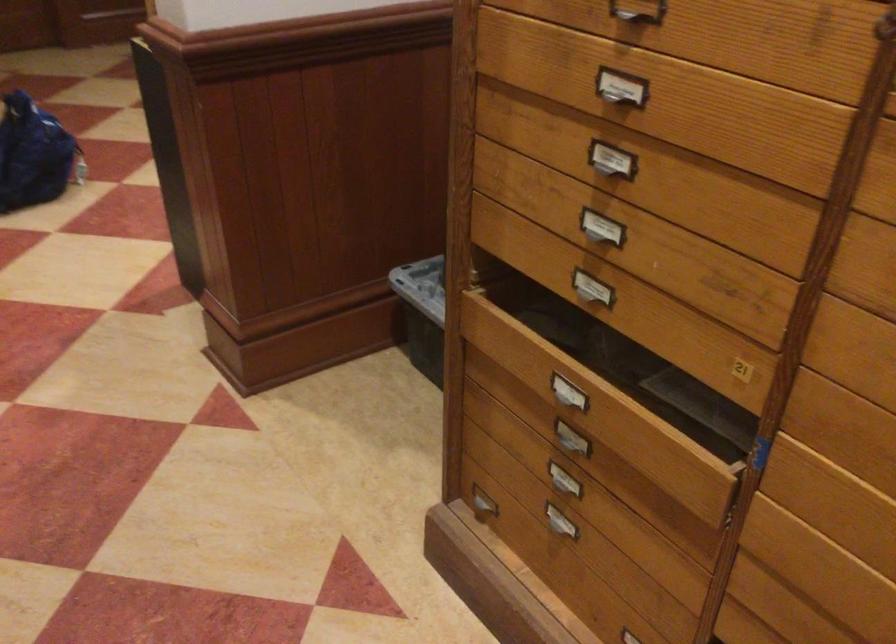
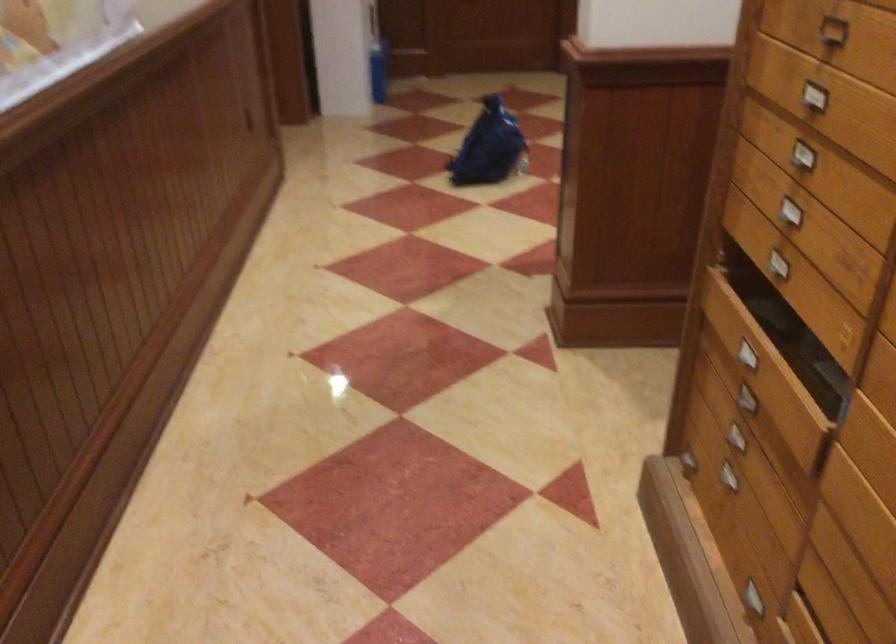
In the second image, find the point that corresponds to pixel 556 391 in the first image.

(746, 354)